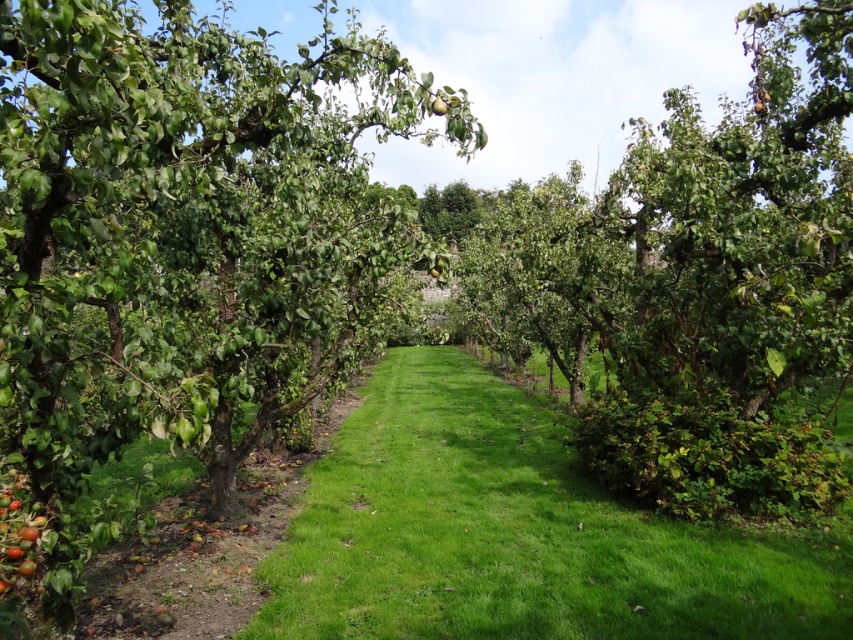
Question: Which point is farther from the camera taking this photo?

Choices:
 (A) (437, 269)
 (B) (386, 506)

Answer: (B)

Question: From the image, what is the correct spatial relationship of green grass at center in relation to green matte apple at center?

Choices:
 (A) above
 (B) below

Answer: (B)

Question: Which object is farther from the camera taking this photo?

Choices:
 (A) ripe red apples at lower left
 (B) green matte apple at center

Answer: (B)

Question: Is green leafy tree at center smaller than ripe red apples at lower left?

Choices:
 (A) no
 (B) yes

Answer: (A)

Question: Which object appears closest to the camera in this image?

Choices:
 (A) green grass at center
 (B) green matte apple at center

Answer: (A)

Question: Does green grass at center appear over ripe red apples at lower left?

Choices:
 (A) yes
 (B) no

Answer: (B)